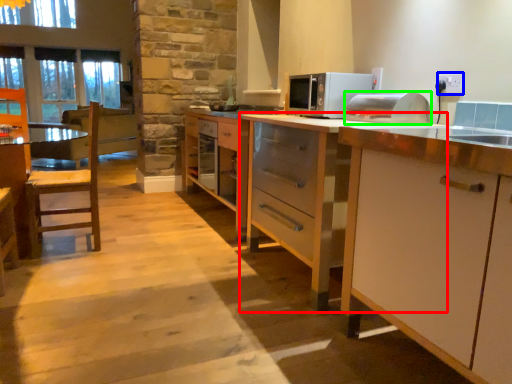
Question: Based on their relative distances, which object is nearer to cabinetry (highlighted by a red box)? Choose from electric outlet (highlighted by a blue box) and appliance (highlighted by a green box).

Choices:
 (A) electric outlet
 (B) appliance

Answer: (B)